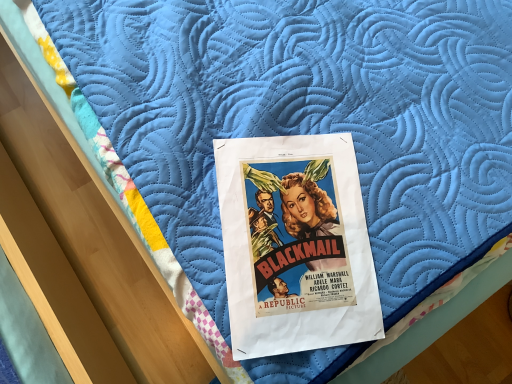
Question: Should I look upward or downward to see matte paper poster at center?

Choices:
 (A) down
 (B) up

Answer: (A)